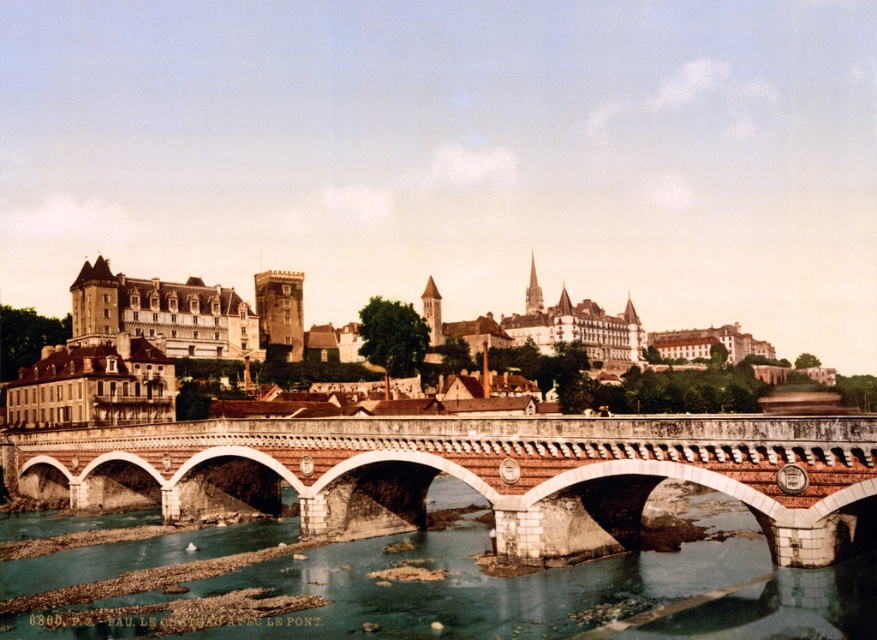
You are a tourist planning to cross the brick stone bridge at center. You have a small boat that is 2 meters wide. Can you safely navigate your boat through the clear water at bridge center without touching the sides?

The brick stone bridge at center is wider than the clear water at bridge center. Since the boat is 2 meters wide, it depends on the actual width of the water passage. However, since the bridge is wider, the water passage might be narrower than the bridge itself. Without exact measurements, it is uncertain if the boat can pass safely. Please check the water width before proceeding.

You are a tourist standing on the bridge and want to take a photo of the matte stone building at center. Where should you position yourself relative to the clear water at bridge center to capture the building in your shot?

You should position yourself to the right of the clear water at bridge center because the matte stone building at center is located to the right of the clear water at bridge center.